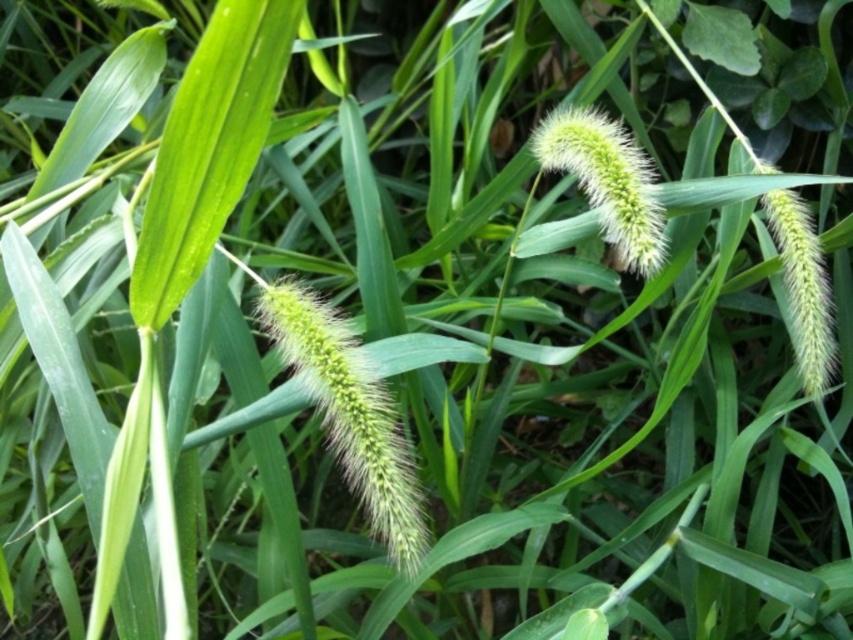
You are a gardener who wants to plant both the green fuzzy grass at center and the green fuzzy flower at center in your garden. The recommended spacing between plants is 16 inches. Based on the image, will the current spacing between them meet the recommended distance?

The green fuzzy grass at center and green fuzzy flower at center are 15.85 inches apart, which is slightly less than the recommended 16 inches. Therefore, the current spacing does not meet the recommended distance.

You are a gardener examining the image. You notice the green fuzzy grass at center and the green fuzzy flower at center. Which one is closer to you?

The green fuzzy grass at center is closer to you because it is in front of the green fuzzy flower at center.